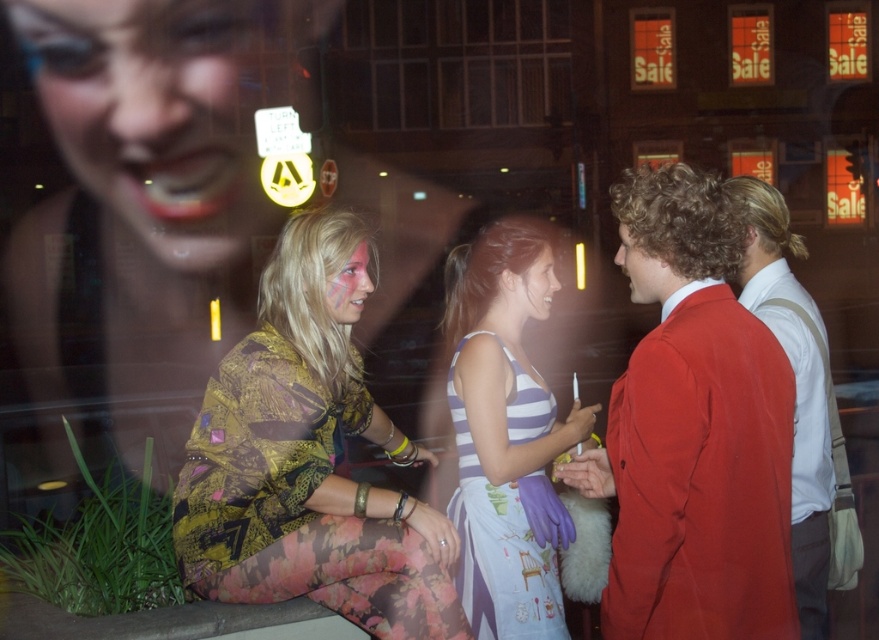
You are a photographer trying to capture the scene through the reflective surface. You want to ensure both the matte red suit at right and the smooth skin face at center are clearly visible in your photo. Given the distortion from the reflection, which object should you focus on first to ensure clarity?

The smooth skin face at center is closer to the reflective surface than the matte red suit at right. To ensure clarity, focus on the smooth skin face at center first.